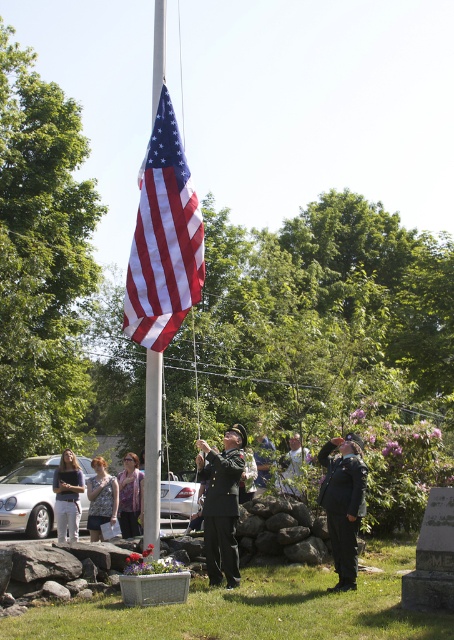
Question: Which object is farther from the camera taking this photo?

Choices:
 (A) white cotton shirt at center
 (B) light brown hair at lower left

Answer: (B)

Question: Based on their relative distances, which object is farther from the dark blue uniform at center?

Choices:
 (A) white cotton shirt at center
 (B) matte fabric flag at center

Answer: (A)

Question: Does dark blue uniform at center appear on the left side of white cotton shirt at center?

Choices:
 (A) yes
 (B) no

Answer: (B)

Question: From the image, what is the correct spatial relationship of uniformed officer at center in relation to dark blue uniform at center?

Choices:
 (A) left
 (B) right

Answer: (A)

Question: Is dark blue uniform at center further to the viewer compared to light brown hair at lower left?

Choices:
 (A) no
 (B) yes

Answer: (A)

Question: Among these points, which one is nearest to the camera?

Choices:
 (A) (128, 524)
 (B) (343, 576)
 (C) (215, 500)
 (D) (167, 189)

Answer: (D)